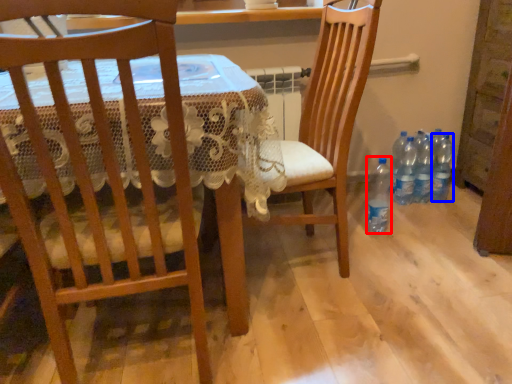
Question: Which object is closer to the camera taking this photo, bottle (highlighted by a red box) or bottle (highlighted by a blue box)?

Choices:
 (A) bottle
 (B) bottle

Answer: (A)